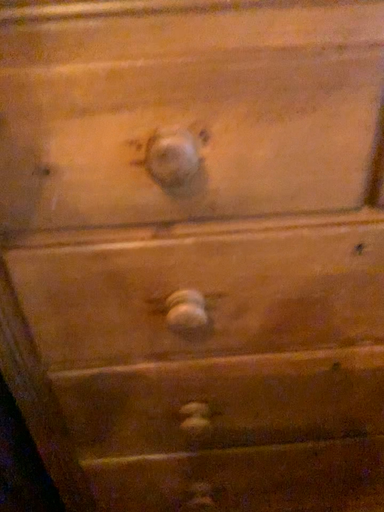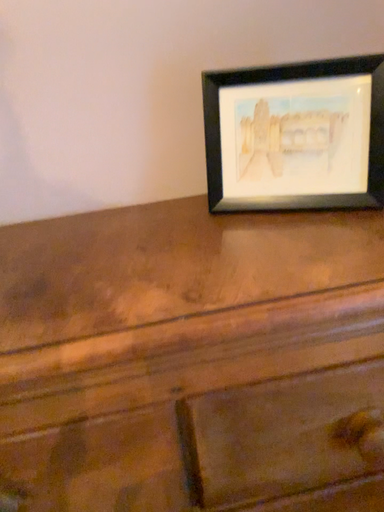
Question: How did the camera likely rotate when shooting the video?

Choices:
 (A) rotated downward
 (B) rotated upward

Answer: (B)